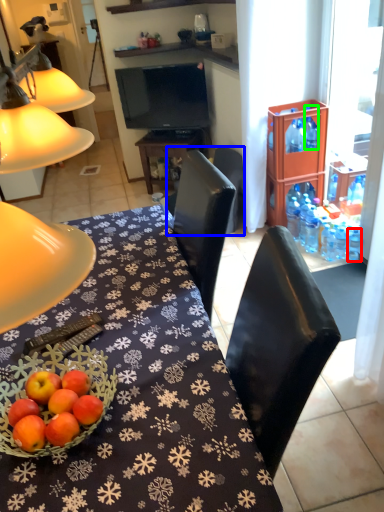
Question: Considering the real-world distances, which object is farthest from bottle (highlighted by a red box)? chair (highlighted by a blue box) or bottle (highlighted by a green box)?

Choices:
 (A) chair
 (B) bottle

Answer: (A)